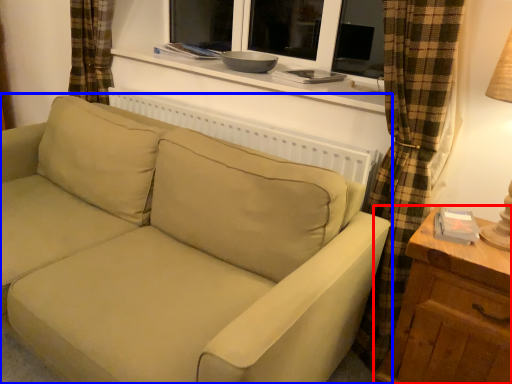
Question: Which object appears farthest to the camera in this image, table (highlighted by a red box) or studio couch (highlighted by a blue box)?

Choices:
 (A) table
 (B) studio couch

Answer: (A)